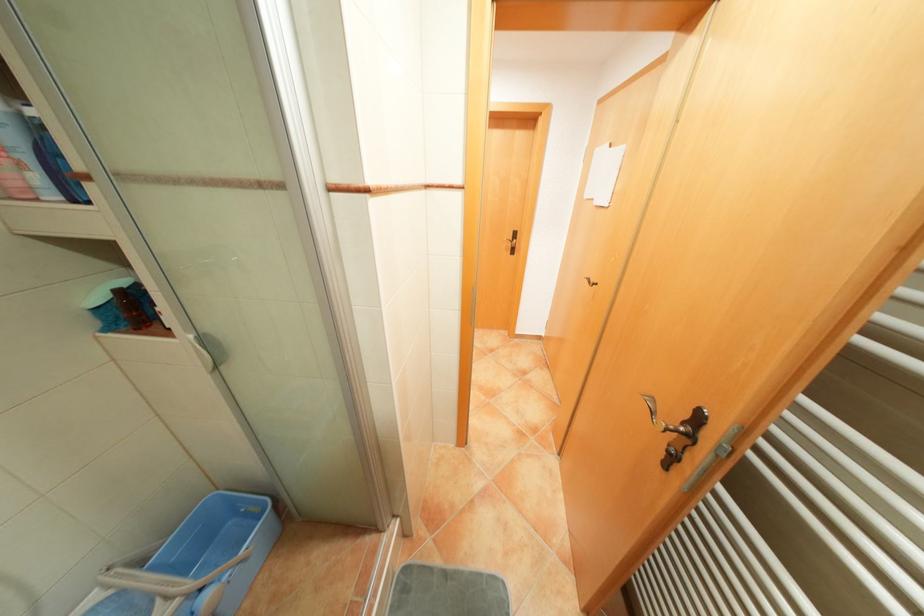
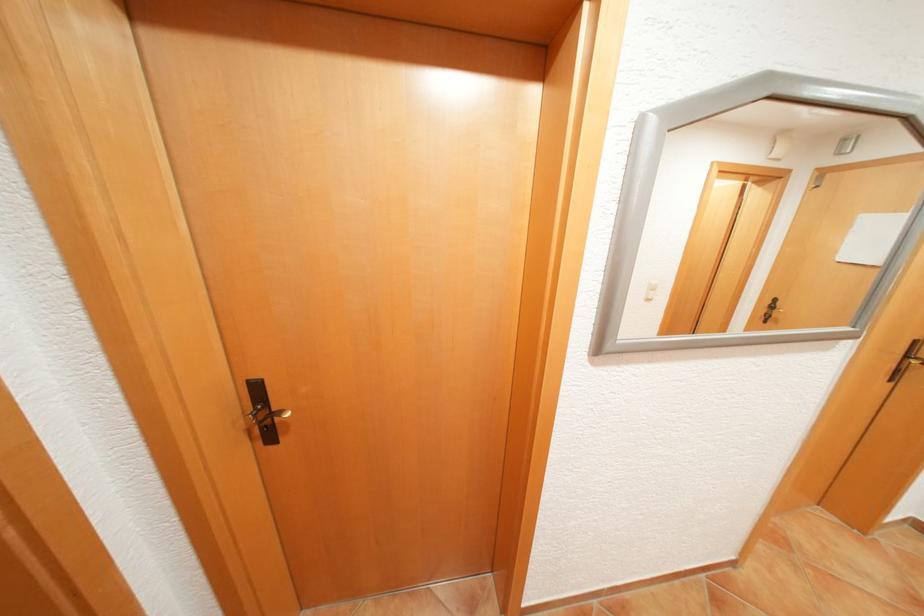
Which direction would the cameraman need to move to produce the second image?

The cameraman walked toward left, forward.